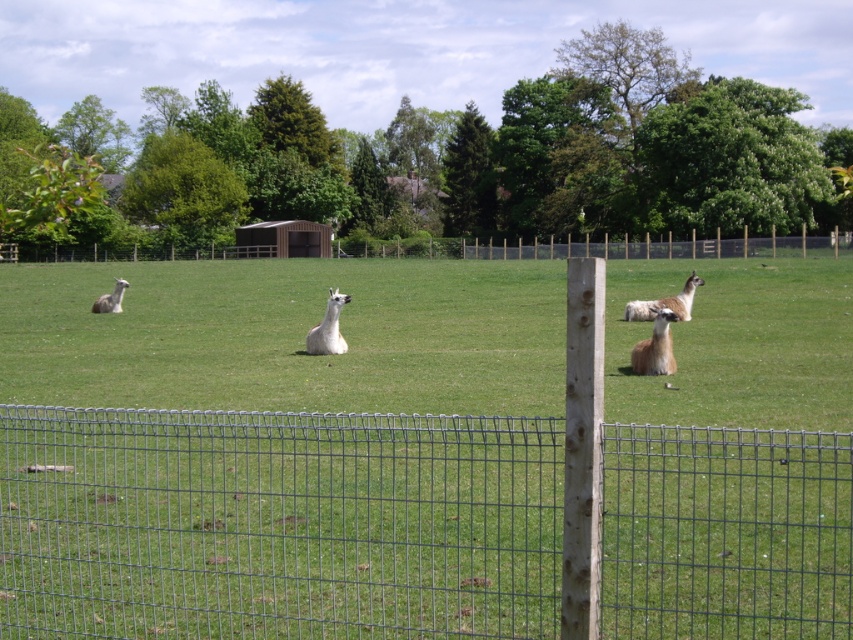
You are standing at the center of the field and want to reach the wooden post at center. Which direction should you walk to get there?

Since the wooden post at center is located at coordinates point (718,244), you should walk towards the center of the field where the wooden post is positioned.